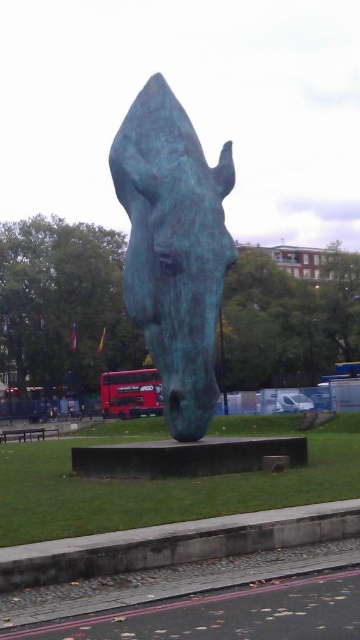
Is bronze horse head at center thinner than red metallic bus at center?

No, bronze horse head at center is not thinner than red metallic bus at center.

Is bronze horse head at center bigger than red metallic bus at center?

Yes, bronze horse head at center is bigger than red metallic bus at center.

This screenshot has height=640, width=360. Identify the location of bronze horse head at center. (173, 248).

Where is `bronze horse head at center`? bronze horse head at center is located at coordinates (173, 248).